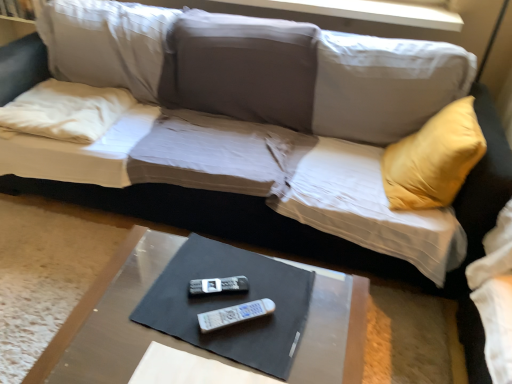
I want to click on free location in front of white plastic remote at center, positioned as the 2th remote in top-to-bottom order, so click(x=234, y=356).